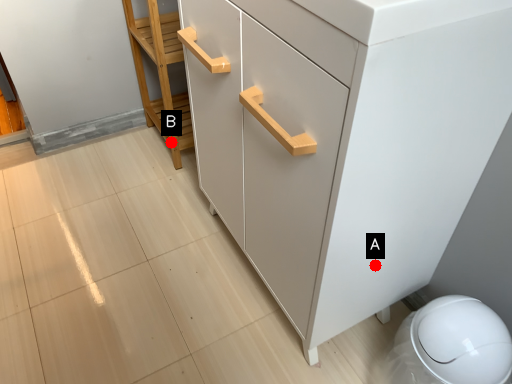
Question: Two points are circled on the image, labeled by A and B beside each circle. Which point is closer to the camera?

Choices:
 (A) A is closer
 (B) B is closer

Answer: (A)